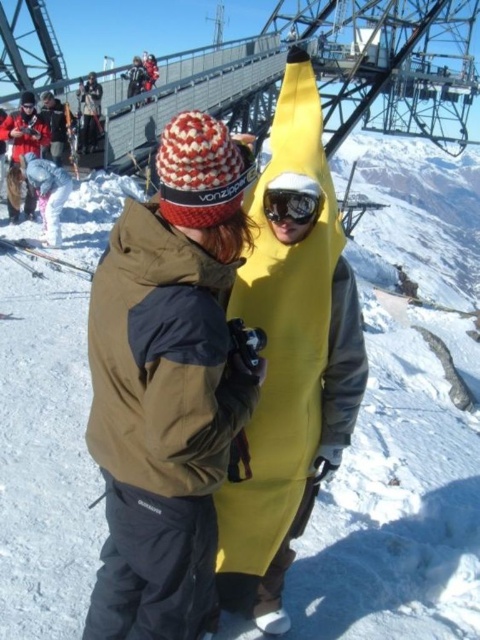
Question: Among these objects, which one is nearest to the camera?

Choices:
 (A) yellow matte/glossy goggles at center
 (B) yellow matte banana at center
 (C) matte black ski at upper left

Answer: (B)

Question: Can you confirm if yellow matte/glossy goggles at center is bigger than metallic silver ski at center?

Choices:
 (A) yes
 (B) no

Answer: (B)

Question: Which object is farther from the camera taking this photo?

Choices:
 (A) yellow matte banana at center
 (B) matte black ski at upper left
 (C) yellow matte/glossy goggles at center

Answer: (B)

Question: Is metallic silver ski at center thinner than matte black ski at upper left?

Choices:
 (A) no
 (B) yes

Answer: (A)

Question: Which point is farther from the camera taking this photo?

Choices:
 (A) (340, 312)
 (B) (52, 262)

Answer: (B)

Question: Can you confirm if yellow matte/glossy goggles at center is positioned above matte black ski at upper left?

Choices:
 (A) yes
 (B) no

Answer: (B)